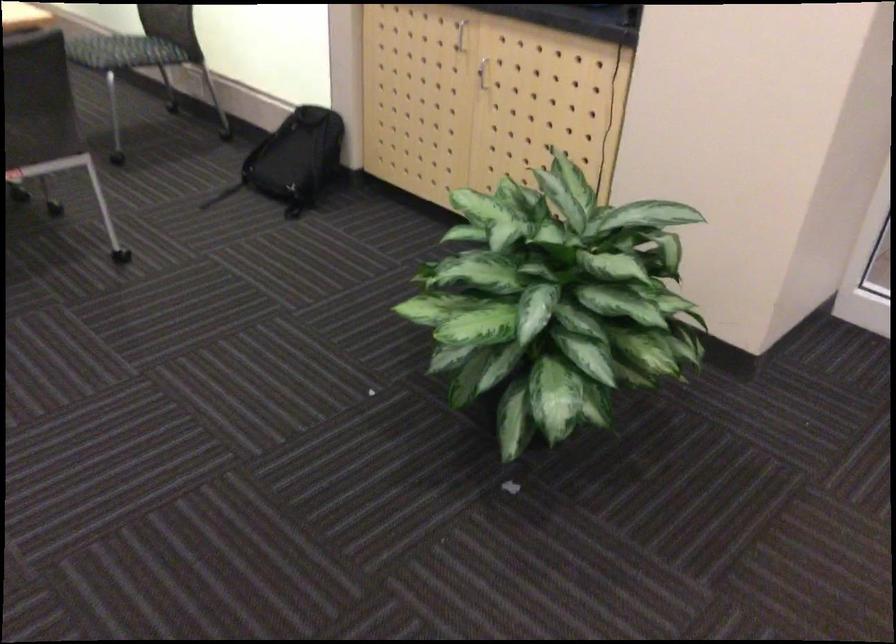
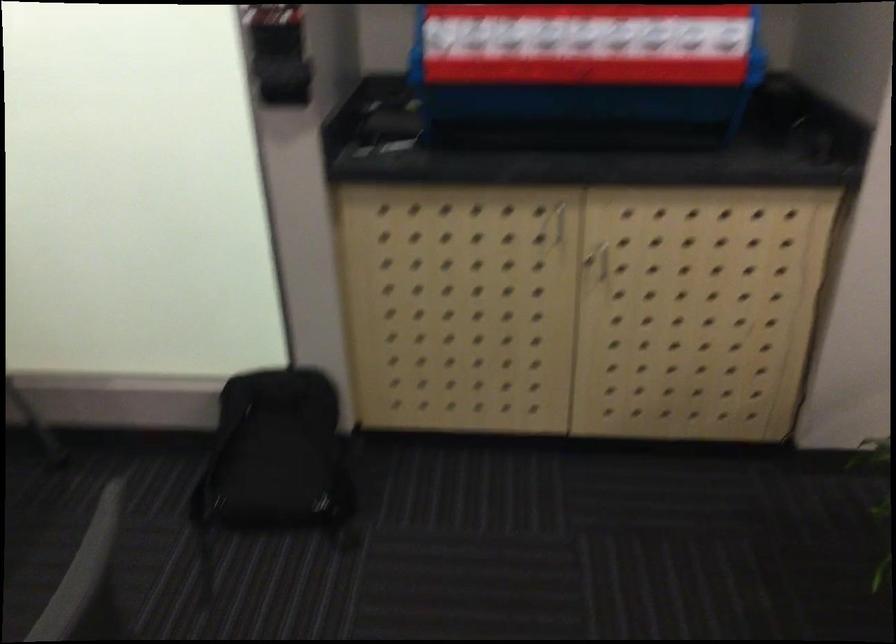
Where in the second image is the point corresponding to point (282, 152) from the first image?

(277, 455)